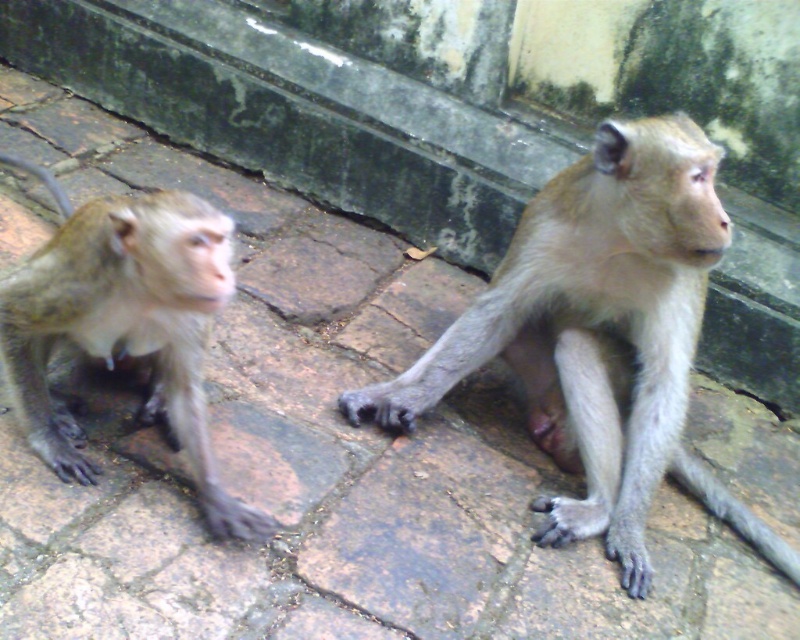
From the picture: You are a zookeeper who needs to place a feeding tray between the two monkeys. The tray requires a minimum of 70 centimeters of space to prevent them from fighting. Based on the image, will the distance between the light brown fur monkey at center and the light brown fur monkey at left allow the tray to be placed safely?

The light brown fur monkey at center and the light brown fur monkey at left are 65.97 centimeters apart from each other, which is less than the required 70 centimeters. Therefore, placing the feeding tray between them may not be safe as the distance is insufficient to prevent fighting.